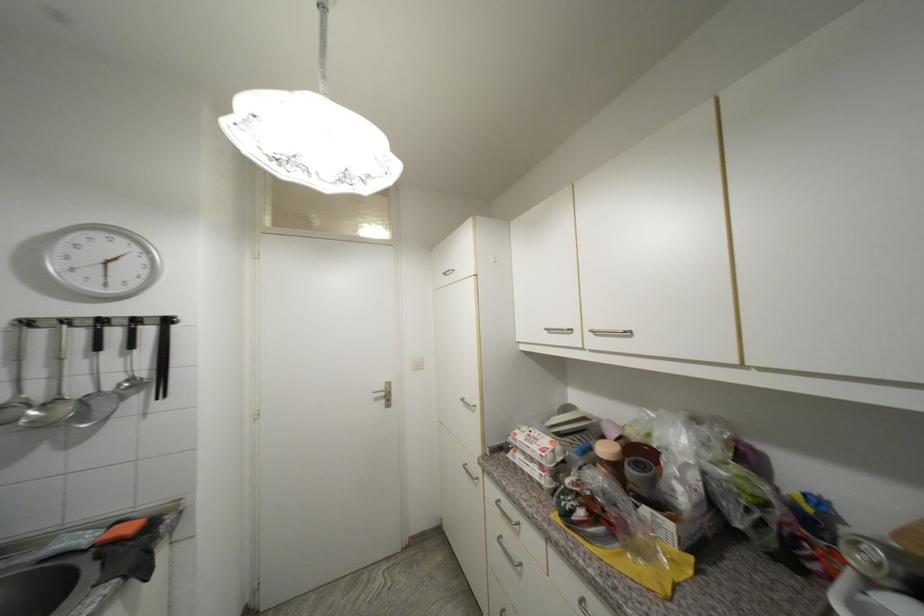
At what (x,y) coordinates should I click in order to perform the action: click on jar lid. Please return your answer as a coordinate pair (x, y). The image size is (924, 616). Looking at the image, I should click on (643, 456).